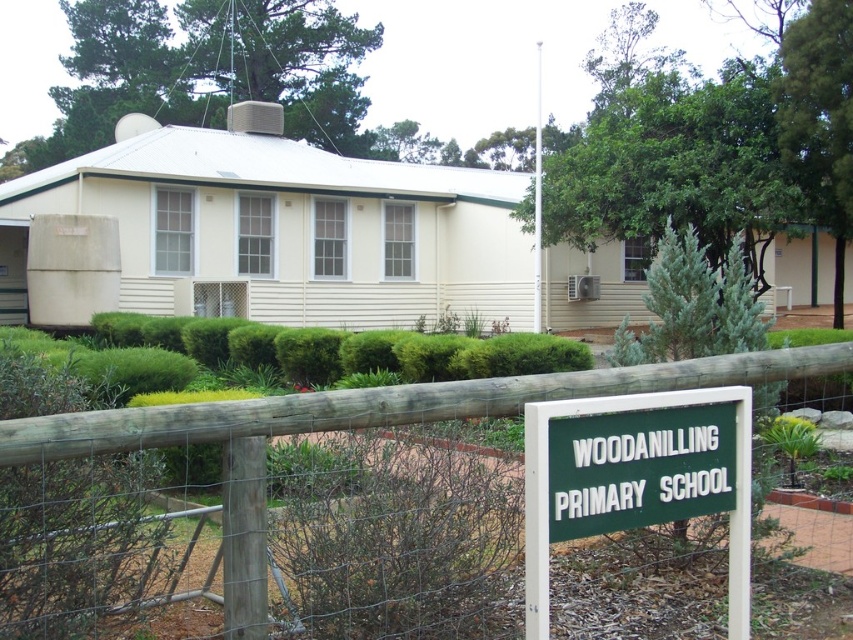
Question: Among these points, which one is farthest from the camera?

Choices:
 (A) [x=722, y=429]
 (B) [x=740, y=372]

Answer: (B)

Question: Does wooden fence at center appear under green plastic sign at center?

Choices:
 (A) no
 (B) yes

Answer: (A)

Question: Which point is farther to the camera?

Choices:
 (A) green plastic sign at center
 (B) wooden fence at center

Answer: (A)

Question: In this image, where is wooden fence at center located relative to green plastic sign at center?

Choices:
 (A) left
 (B) right

Answer: (A)

Question: Does wooden fence at center have a smaller size compared to green plastic sign at center?

Choices:
 (A) yes
 (B) no

Answer: (B)

Question: Which point appears closest to the camera in this image?

Choices:
 (A) (738, 365)
 (B) (625, 481)

Answer: (B)